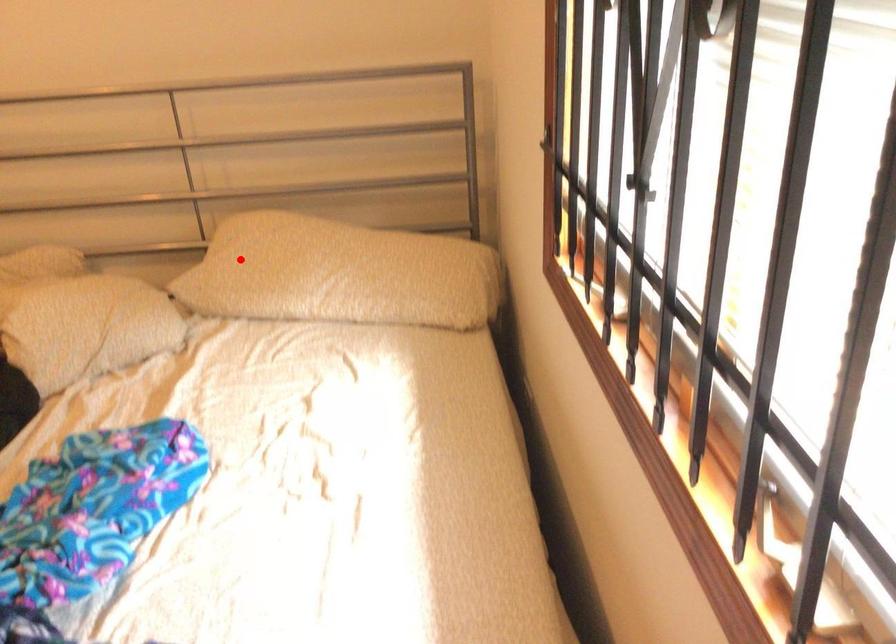
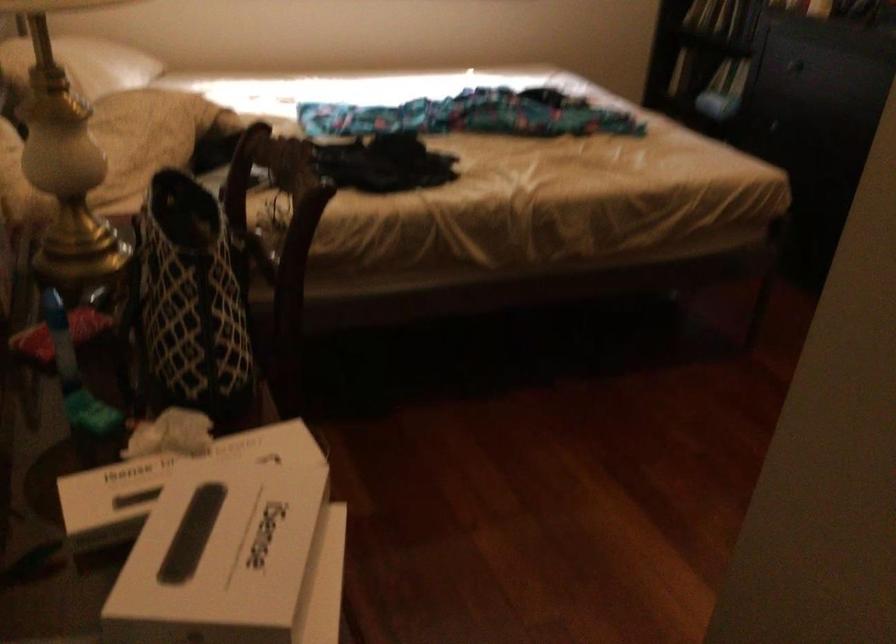
In the second image, find the point that corresponds to the highlighted location in the first image.

(82, 64)